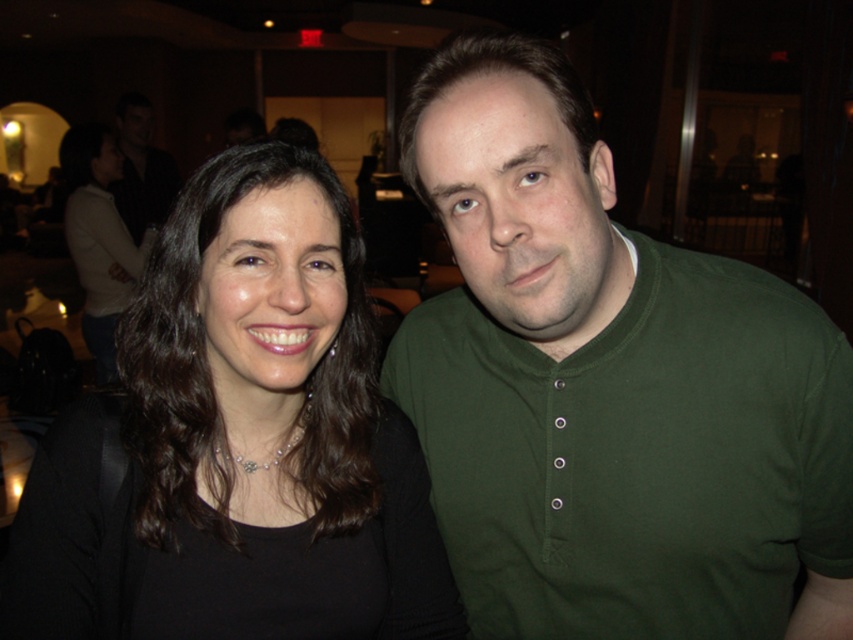
This screenshot has width=853, height=640. What do you see at coordinates (608, 387) in the screenshot?
I see `green cotton shirt at center` at bounding box center [608, 387].

Consider the image. Does green cotton shirt at center appear on the right side of matte black shirt at upper left?

Yes, green cotton shirt at center is to the right of matte black shirt at upper left.

Describe the element at coordinates (608, 387) in the screenshot. I see `green cotton shirt at center` at that location.

Find the location of `green cotton shirt at center`. green cotton shirt at center is located at coordinates (608, 387).

Can you confirm if green cotton shirt at center is positioned above black matte shirt at center?

Correct, green cotton shirt at center is located above black matte shirt at center.

Is green cotton shirt at center to the right of black matte shirt at center from the viewer's perspective?

Indeed, green cotton shirt at center is positioned on the right side of black matte shirt at center.

Measure the distance between green cotton shirt at center and camera.

23.75 inches

The image size is (853, 640). What are the coordinates of `green cotton shirt at center` in the screenshot? It's located at (608, 387).

Who is more distant from viewer, (x=273, y=304) or (x=146, y=157)?

Point (x=146, y=157)

Between black matte shirt at center and matte black shirt at upper left, which one has more height?

matte black shirt at upper left is taller.

At what (x,y) coordinates should I click in order to perform the action: click on black matte shirt at center. Please return your answer as a coordinate pair (x, y). Looking at the image, I should click on (236, 449).